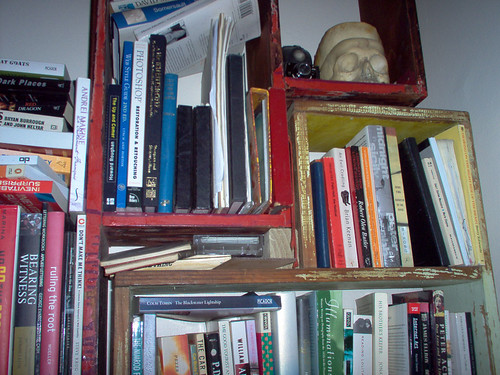
In order to click on cubbies in this screenshot , I will do coord(404,23), coord(270,44), coord(324,129), coord(468,298).